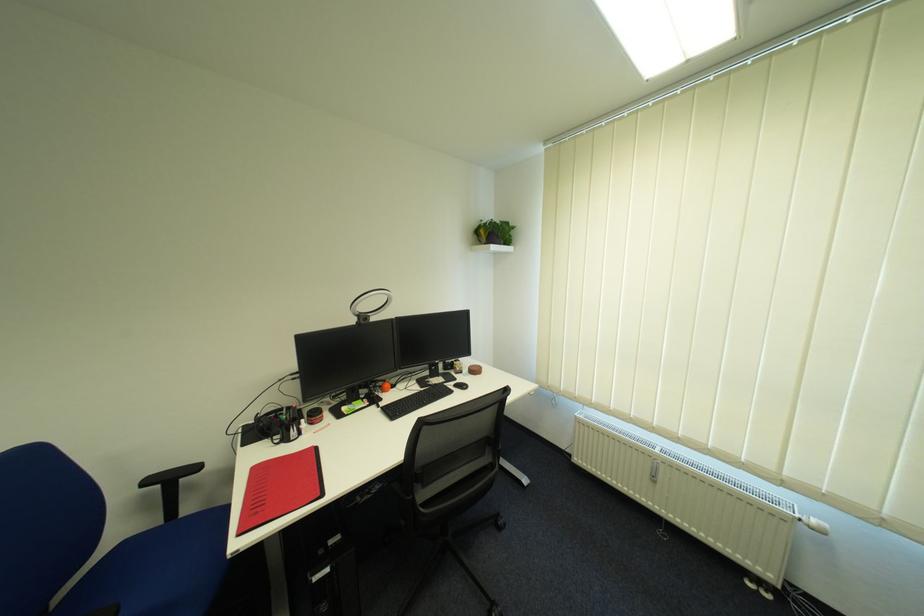
Where is `blind control chain`? The height and width of the screenshot is (616, 924). blind control chain is located at coordinates (555, 402).